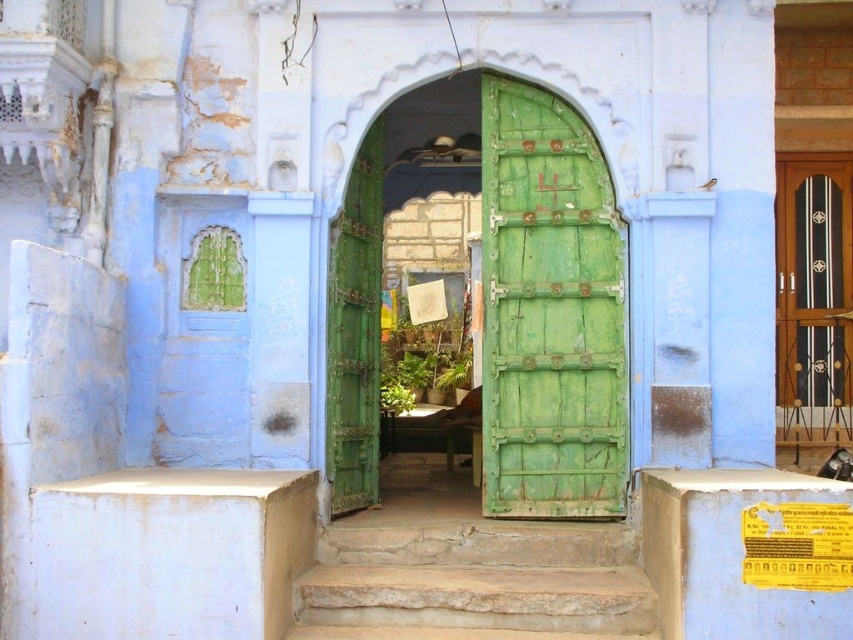
Who is positioned more to the left, green wooden door at center or green weathered wood door at center?

green wooden door at center

The image size is (853, 640). Describe the element at coordinates (550, 308) in the screenshot. I see `green wooden door at center` at that location.

Locate an element on the screen. The image size is (853, 640). green wooden door at center is located at coordinates (550, 308).

Is green wooden door at center taller than stone steps at center?

Yes.

Between green wooden door at center and stone steps at center, which one has less height?

Standing shorter between the two is stone steps at center.

Find the location of a particular element. This screenshot has width=853, height=640. green wooden door at center is located at coordinates (550, 308).

Is green weathered wood door at center to the left of stone steps at center from the viewer's perspective?

No, green weathered wood door at center is not to the left of stone steps at center.

Which is more to the left, green weathered wood door at center or stone steps at center?

stone steps at center

At what (x,y) coordinates should I click in order to perform the action: click on green weathered wood door at center. Please return your answer as a coordinate pair (x, y). This screenshot has width=853, height=640. Looking at the image, I should click on (550, 310).

Find the location of `green weathered wood door at center`. green weathered wood door at center is located at coordinates (550, 310).